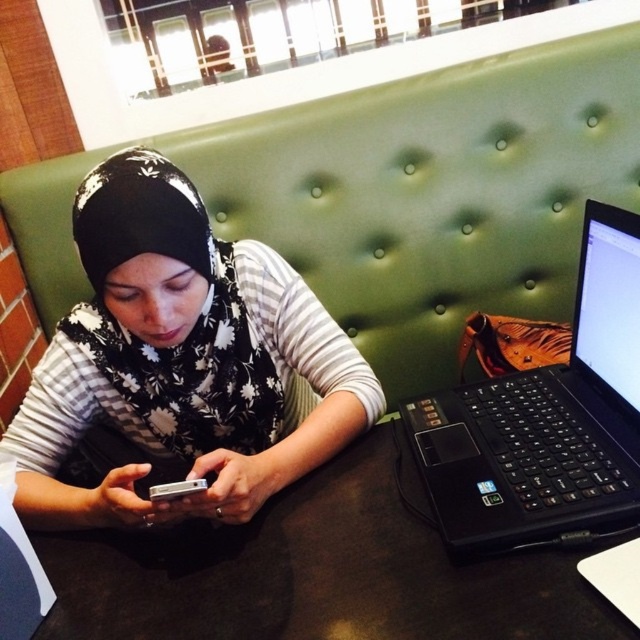
You are trying to take a photo of the point at coordinates (538, 576) in the scene. The camera you are using has a minimum focus distance of 25 inches. Will the point be in focus?

The point at coordinates (538, 576) is 24.23 inches from the camera, which is closer than the minimum focus distance of 25 inches. Therefore, the point will not be in focus.

You are a delivery person who needs to place a 24 inch long package between the black matte laptop at right and the person. Can you fit it there?

The distance between the black matte laptop at right and the person is 24.82 inches, so the 24 inch long package can fit between them with a small amount of space to spare.